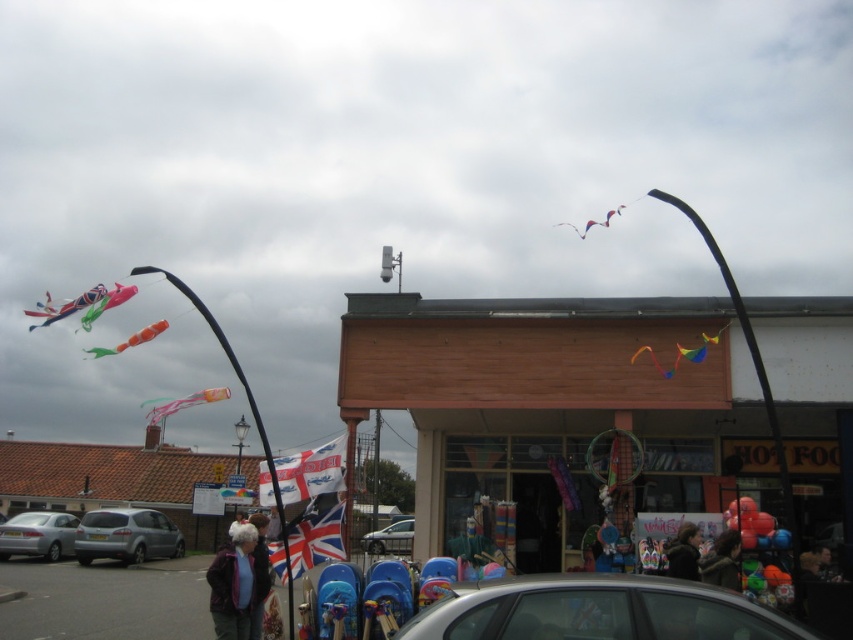
Question: Does purple fleece jacket at lower left have a lesser width compared to silver metallic car at center?

Choices:
 (A) no
 (B) yes

Answer: (B)

Question: Which object appears closest to the camera in this image?

Choices:
 (A) matte plastic kite at upper left
 (B) silver metallic car at center
 (C) rainbow fabric kite at center
 (D) multicolored fabric kite at upper center

Answer: (A)

Question: Which point is farther from the camera taking this photo?

Choices:
 (A) (173, 406)
 (B) (302, 568)
 (C) (695, 560)
 (D) (253, 586)

Answer: (B)

Question: Does wooden signboard at center come behind rainbow fabric kite at center?

Choices:
 (A) yes
 (B) no

Answer: (B)

Question: Which is farther from the translucent plastic kite at center?

Choices:
 (A) rainbow fabric kite at center
 (B) silver metallic car at center
 (C) matte plastic kite at upper left

Answer: (B)

Question: Is wooden signboard at center bigger than silver metallic hatchback at lower left?

Choices:
 (A) yes
 (B) no

Answer: (A)